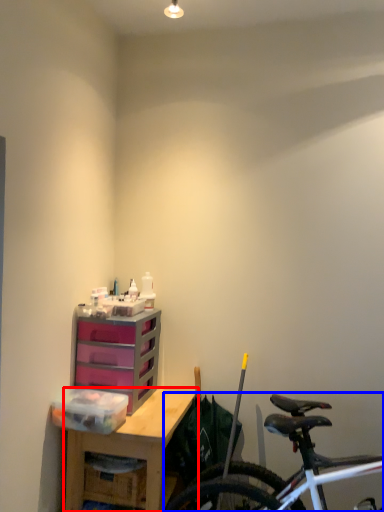
Question: Among these objects, which one is farthest to the camera, desk (highlighted by a red box) or bicycle (highlighted by a blue box)?

Choices:
 (A) desk
 (B) bicycle

Answer: (A)